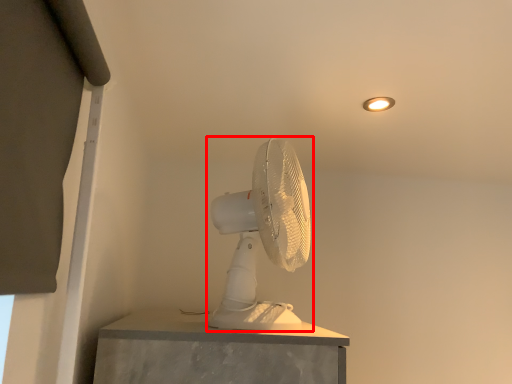
Question: Where is mechanical fan (annotated by the red box) located in relation to light fixture in the image?

Choices:
 (A) right
 (B) left

Answer: (B)